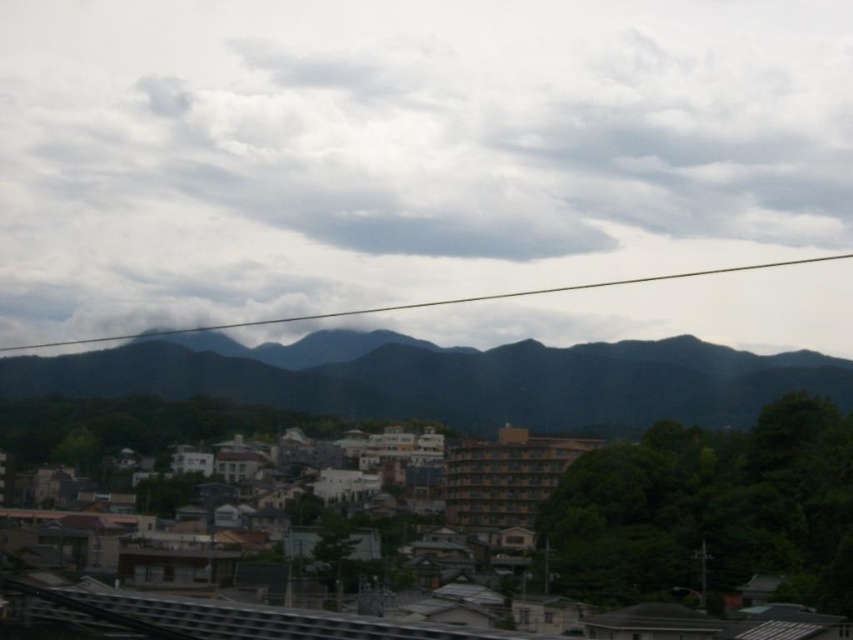
Is point (520, 355) farther from viewer compared to point (230, 323)?

No, it is in front of (230, 323).

Is point (541, 429) closer to viewer compared to point (653, 276)?

Yes, it is.

This screenshot has width=853, height=640. What are the coordinates of `dark green textured mountains at center` in the screenshot? It's located at (447, 378).

You are a GUI agent. You are given a task and a screenshot of the screen. Output one action in this format:
    pyautogui.click(x=<x>, y=<y>)
    Task: Click on the dark green textured mountains at center
    
    Given the screenshot: What is the action you would take?
    pyautogui.click(x=447, y=378)

Who is shorter, cloudy sky at upper center or transparent wire at upper center?

With less height is transparent wire at upper center.

Between point (399, 144) and point (183, 330), which one is positioned in front?

Point (183, 330) is more forward.

Is point (683, 241) more distant than point (126, 339)?

Yes, point (683, 241) is farther from viewer.

The height and width of the screenshot is (640, 853). What are the coordinates of `cloudy sky at upper center` in the screenshot? It's located at (403, 150).

Is cloudy sky at upper center closer to camera compared to dark green textured mountains at center?

No, cloudy sky at upper center is behind dark green textured mountains at center.

Consider the image. Is cloudy sky at upper center positioned behind dark green textured mountains at center?

Yes, cloudy sky at upper center is behind dark green textured mountains at center.

Where is `cloudy sky at upper center`? This screenshot has width=853, height=640. cloudy sky at upper center is located at coordinates (403, 150).

Where is `cloudy sky at upper center`? This screenshot has width=853, height=640. cloudy sky at upper center is located at coordinates (403, 150).